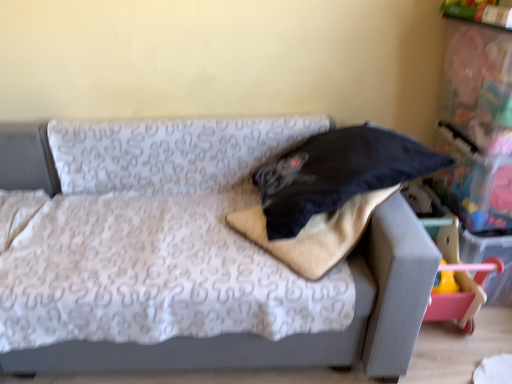
Question: Does point (305, 362) appear closer or farther from the camera than point (301, 208)?

Choices:
 (A) farther
 (B) closer

Answer: (A)

Question: Is textured gray couch at center to the left or to the right of black fabric pillow at center in the image?

Choices:
 (A) right
 (B) left

Answer: (B)

Question: In the image, is textured gray couch at center positioned in front of or behind black fabric pillow at center?

Choices:
 (A) front
 (B) behind

Answer: (A)

Question: From the image's perspective, is black fabric pillow at center positioned above or below textured gray couch at center?

Choices:
 (A) above
 (B) below

Answer: (A)

Question: Is black fabric pillow at center bigger or smaller than textured gray couch at center?

Choices:
 (A) small
 (B) big

Answer: (A)

Question: Is point (324, 150) positioned closer to the camera than point (404, 347)?

Choices:
 (A) farther
 (B) closer

Answer: (A)

Question: From a real-world perspective, relative to textured gray couch at center, is black fabric pillow at center vertically above or below?

Choices:
 (A) above
 (B) below

Answer: (A)